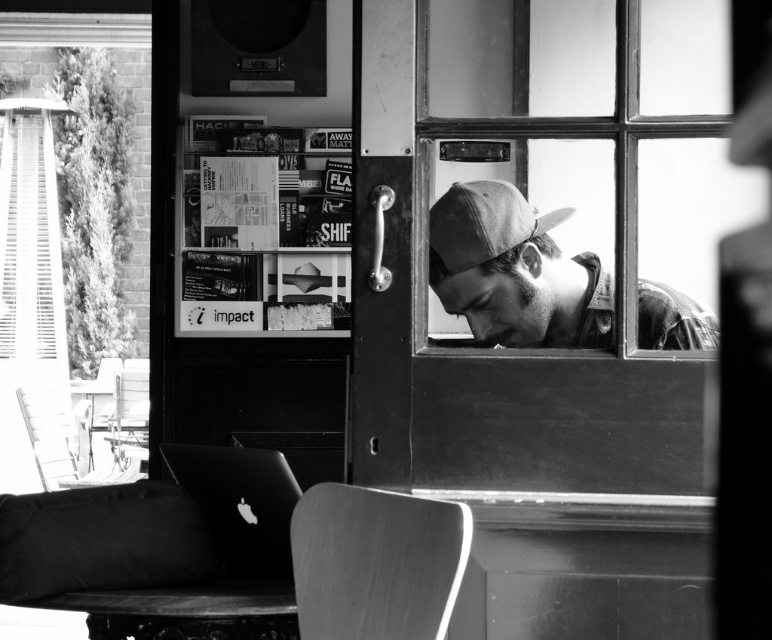
You are a photographer adjusting your camera settings to focus on two points in the scene. The points are labeled as point (346, 314) and point (263, 540). Which point should you focus on first if you want to ensure both are in focus?

You should focus on point (346, 314) first because it is closer to the camera than point (263, 540). By focusing on the closer point, the farther point will also be within the depth of field.

You are standing at the point marked as point (273, 460) in the image. You want to move to the door in the background. The door is 1.8 meters tall. If you are 1.7 meters tall, can you reach the top of the door without any assistance?

The point (273, 460) is 2.67 meters away from the viewer. Since the door is 1.8 meters tall and you are 1.7 meters tall, you cannot reach the top of the door without assistance because your height is slightly less than the door height.

From the picture: You are standing in the cafe and want to take a photo of the man wearing a baseball cap. The camera you have can only focus on objects within 5 meters. Is the point at coordinates point [295,316] within the focus range of your camera?

The point at coordinates point [295,316] is 4.86 meters away from the camera, which is within the 5 meters focus range. Therefore, the camera can focus on that point.